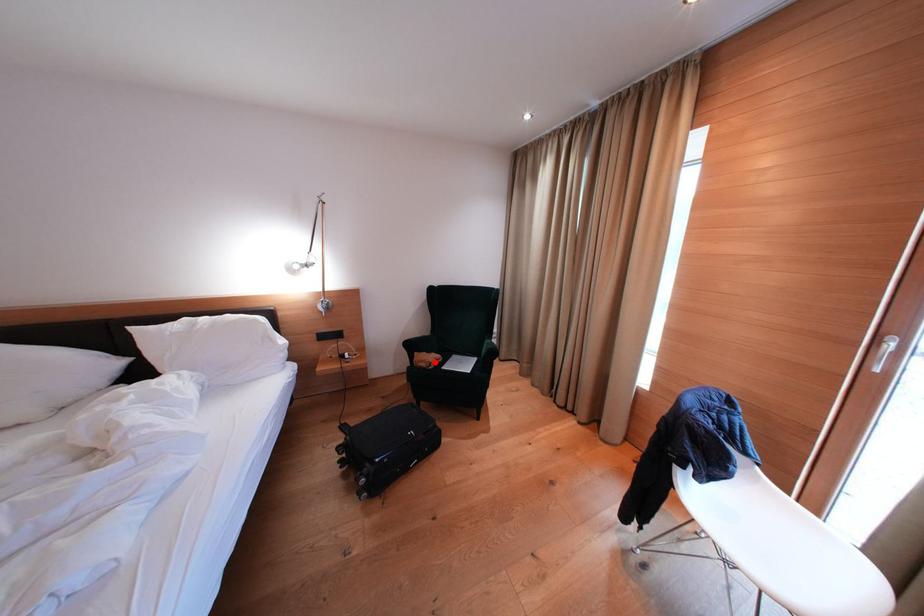
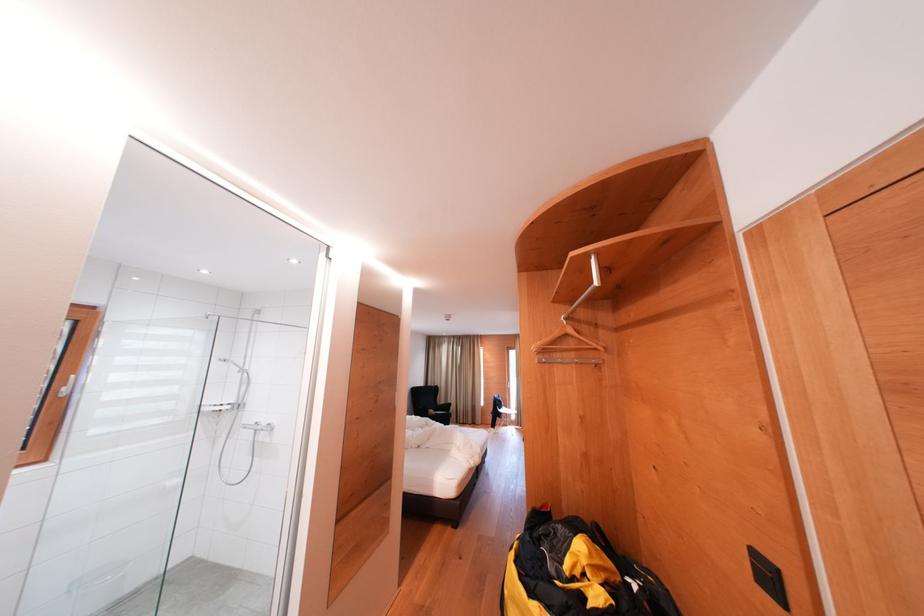
Question: I am providing you with two images of the same scene from different viewpoints. Image1 has a red point marked. In image2, the corresponding 3D location appears at what relative position? Reply with the corresponding letter.

Choices:
 (A) Closer
 (B) Farther

Answer: (B)